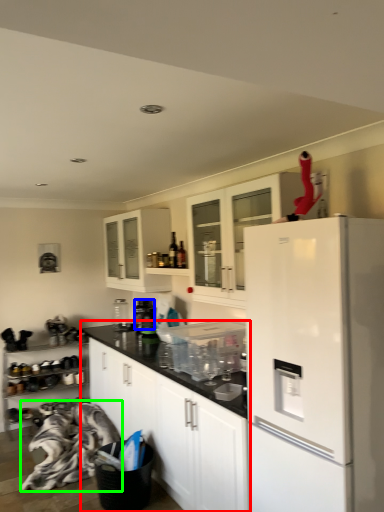
Question: Which object is positioned closest to cabinetry (highlighted by a red box)? Select from appliance (highlighted by a blue box) and material (highlighted by a green box).

Choices:
 (A) appliance
 (B) material

Answer: (B)